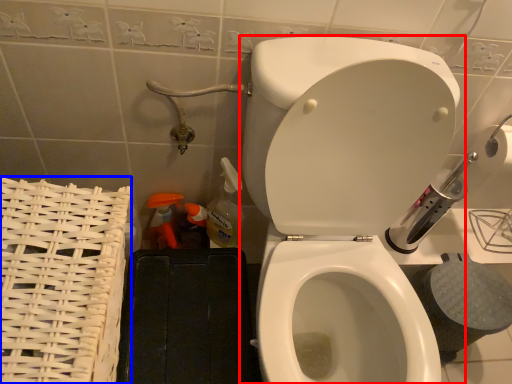
Question: Among these objects, which one is farthest to the camera, toilet (highlighted by a red box) or basket (highlighted by a blue box)?

Choices:
 (A) toilet
 (B) basket

Answer: (B)